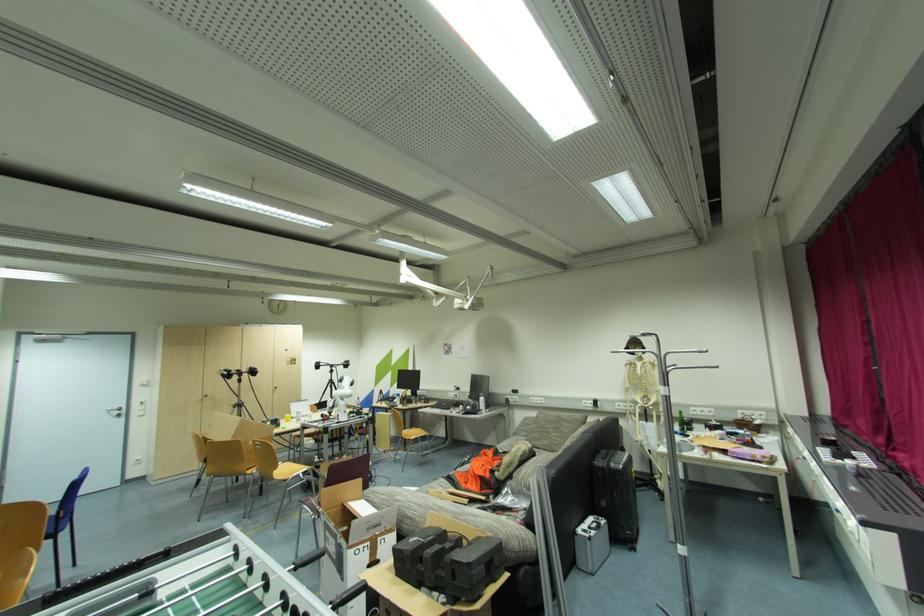
In order to click on black suitcase handle in this screenshot , I will do `click(604, 455)`.